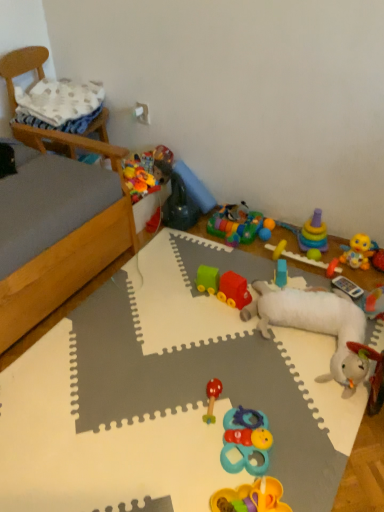
Where is `free space that is in between green rubber ball at upper right, the fourth toy from the top, and yellow rubber duck at right, which is the eighth toy from bottom to top`? The width and height of the screenshot is (384, 512). free space that is in between green rubber ball at upper right, the fourth toy from the top, and yellow rubber duck at right, which is the eighth toy from bottom to top is located at coordinates (332, 260).